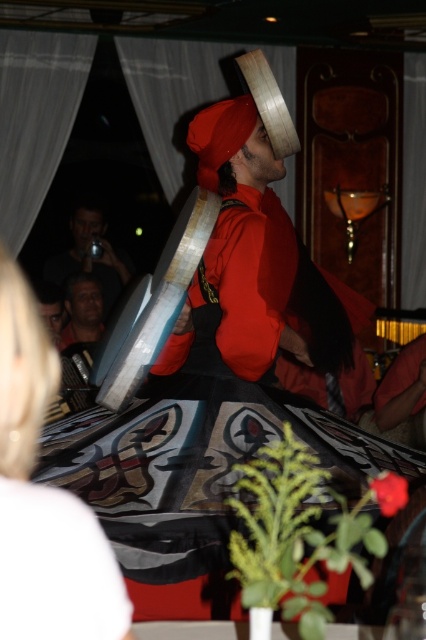
You are a photographer at the event and want to take a closeup shot of the performer. The camera you have can focus on subjects within 30 inches. Do you think the matte black camera at upper left can capture the matte black face at center clearly?

The matte black camera at upper left is 29.35 inches from matte black face at center, which is within the camera focus range of 30 inches. Therefore, the matte black camera at upper left can capture the matte black face at center clearly.

You are a photographer trying to capture the performer at a cultural event. You have a matte black camera at upper left and see the matte black face at center. Which object is closer to you, the photographer?

The matte black camera at upper left is closer to you than the matte black face at center.

You are a photographer at the event and want to capture the performer with both the blonde hair at upper left and the matte black camera at upper left in the frame. Which object should you focus on first to ensure both are in the shot?

You should focus on the matte black camera at upper left first because it is larger than the blonde hair at upper left, ensuring both fit within the frame.